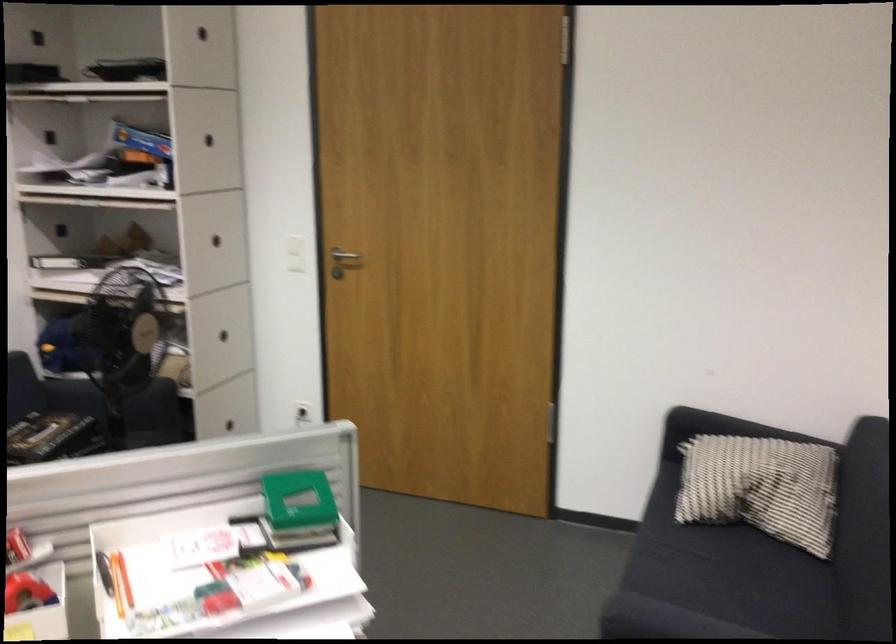
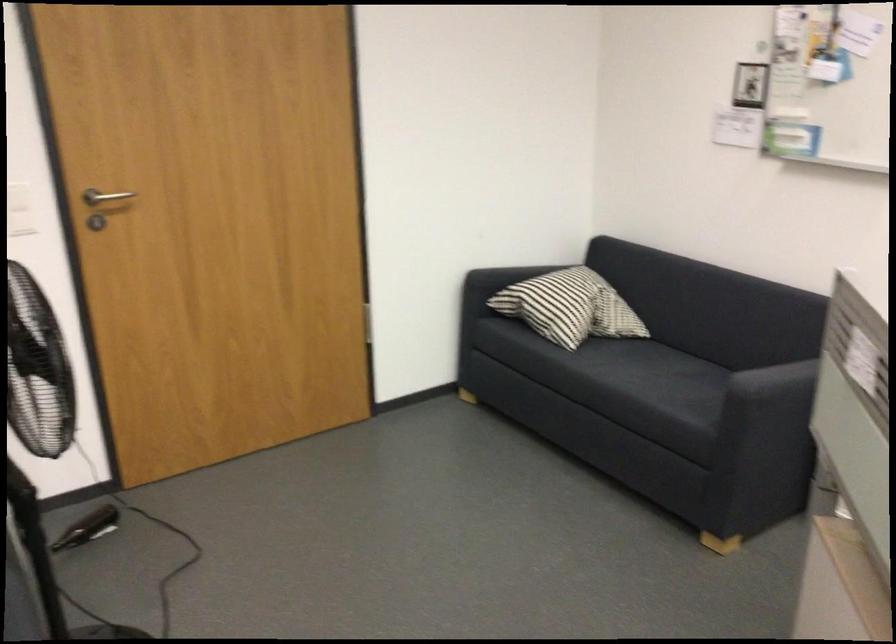
Question: I am providing you with two images of the same scene from different viewpoints. Please identify which objects are invisible in image2.

Choices:
 (A) silver door handle
 (B) striped pillow
 (C) sofa armrest
 (D) none of these

Answer: (D)